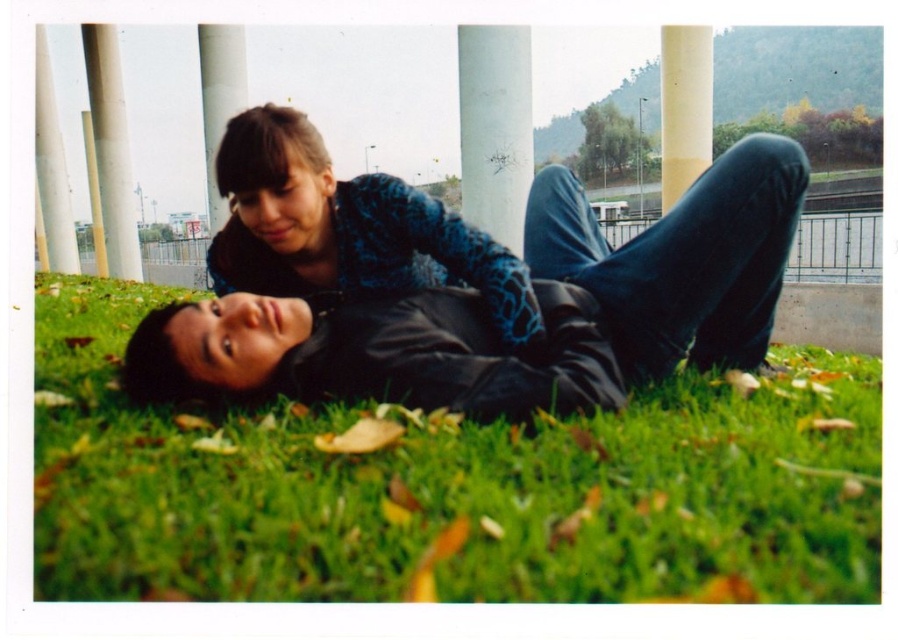
You are a photographer standing near the black leather jacket at lower left. You want to take a photo of the camera that is 7.36 feet away. Is the camera visible from your current position without moving your feet?

The camera is 7.36 feet away from the black leather jacket at lower left. Since the scene describes the two individuals lying on the grass with the background columns partially obscuring the view, it is possible that the camera is visible unless there are obstructions like the columns or people. However, the description does not mention any obstruction between the jacket and the camera, so assuming no physical barriers, the camera should be visible from the photographer